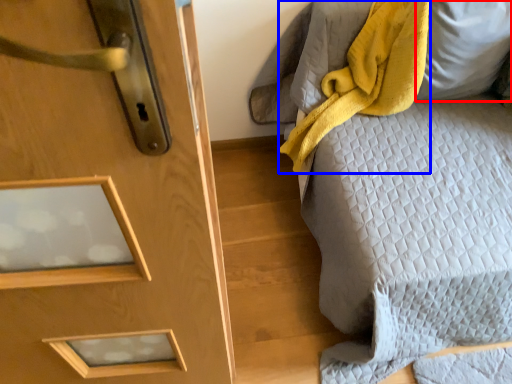
Question: Which object is closer to the camera taking this photo, pillow (highlighted by a red box) or blanket (highlighted by a blue box)?

Choices:
 (A) pillow
 (B) blanket

Answer: (B)